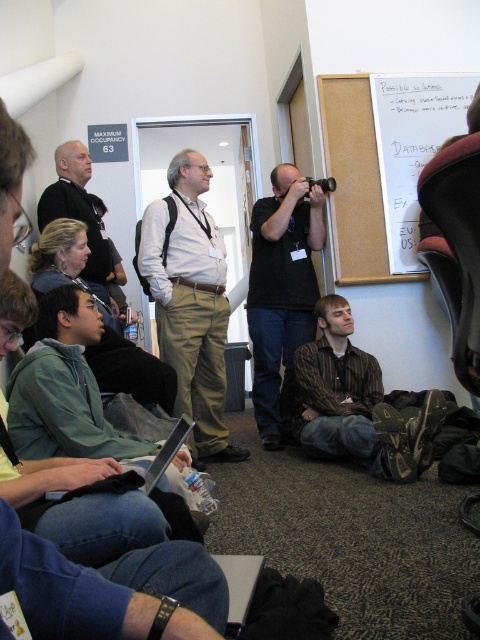
Question: Among these objects, which one is farthest from the camera?

Choices:
 (A) matte black shirt at upper left
 (B) black plastic video camera at center

Answer: (B)

Question: Is whiteboard at upper right bigger than black plastic video camera at center?

Choices:
 (A) no
 (B) yes

Answer: (B)

Question: From the image, what is the correct spatial relationship of white matte shirt at center in relation to black matte camera at center?

Choices:
 (A) right
 (B) left

Answer: (B)

Question: Based on their relative distances, which object is farther from the brown striped shirt at lower center?

Choices:
 (A) silver metallic laptop at lower left
 (B) black plastic video camera at center

Answer: (A)

Question: Which point is farther to the camera?

Choices:
 (A) (349, 234)
 (B) (204, 278)
 (C) (257, 378)
 (D) (343, 428)

Answer: (C)

Question: Does green fabric jacket at lower left appear over black plastic video camera at center?

Choices:
 (A) yes
 (B) no

Answer: (B)